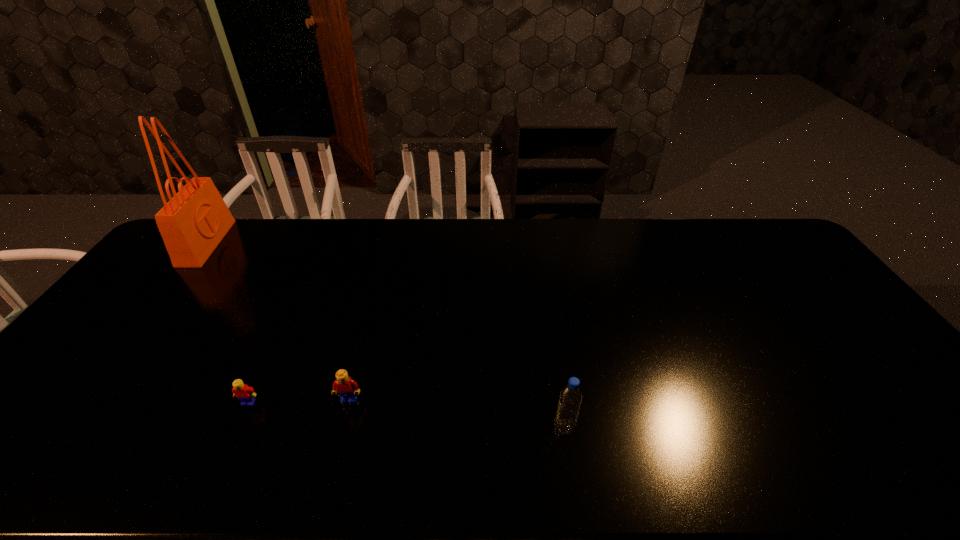
Find the location of a particular element. The image size is (960, 540). tote bag is located at coordinates (192, 224).

Where is `the tallest object`? This screenshot has height=540, width=960. the tallest object is located at coordinates (192, 224).

Image resolution: width=960 pixels, height=540 pixels. I want to click on water bottle, so click(x=570, y=399).

The height and width of the screenshot is (540, 960). I want to click on the second tallest object, so click(570, 399).

Where is `the second object from right to left`? The width and height of the screenshot is (960, 540). the second object from right to left is located at coordinates (347, 389).

Image resolution: width=960 pixels, height=540 pixels. I want to click on the third tallest object, so click(347, 389).

You are a GUI agent. You are given a task and a screenshot of the screen. Output one action in this format:
    pyautogui.click(x=<x>, y=<y>)
    Task: Click on the left Lego
    This screenshot has height=540, width=960.
    Given the screenshot: What is the action you would take?
    pyautogui.click(x=245, y=394)

The image size is (960, 540). Identify the location of the shortest object. (245, 394).

I want to click on free space located 0.300m on the logo side of the leftmost object, so click(303, 243).

Where is `free space located 0.170m on the back of the water bottle`? This screenshot has height=540, width=960. free space located 0.170m on the back of the water bottle is located at coordinates (554, 362).